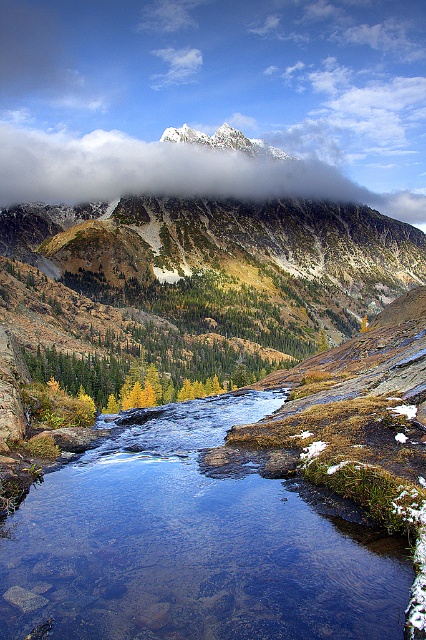
Question: Which object is closer to the camera taking this photo?

Choices:
 (A) white fluffy cloud at upper center
 (B) clear water stream at center

Answer: (B)

Question: Is the position of clear water stream at center more distant than that of white fluffy cloud at upper center?

Choices:
 (A) no
 (B) yes

Answer: (A)

Question: Can you confirm if clear water stream at center is positioned above white fluffy cloud at upper center?

Choices:
 (A) yes
 (B) no

Answer: (B)

Question: Observing the image, what is the correct spatial positioning of clear water stream at center in reference to white fluffy cloud at upper center?

Choices:
 (A) left
 (B) right

Answer: (B)